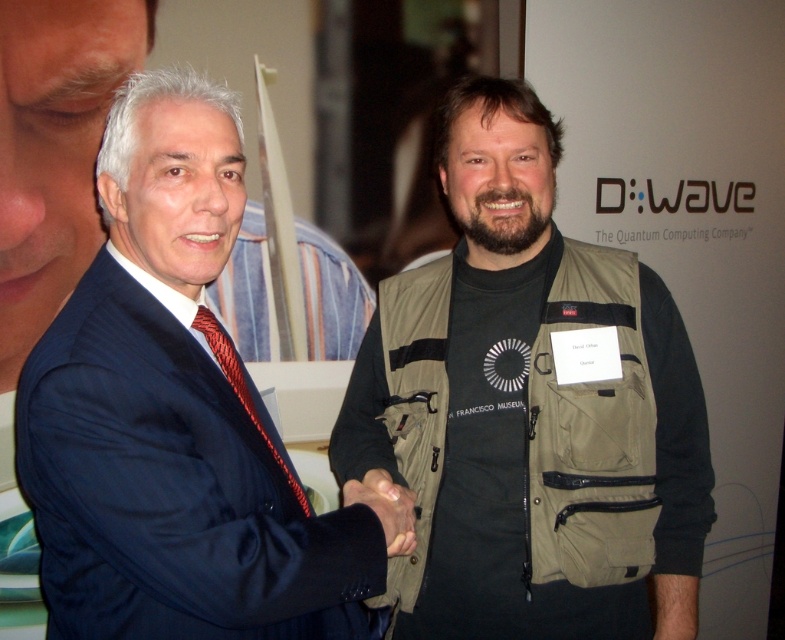
Question: Which object is closer to the camera taking this photo?

Choices:
 (A) smooth skin hand at center
 (B) khaki fabric vest at center

Answer: (A)

Question: Does khaki fabric vest at center appear on the left side of matte blue suit at center?

Choices:
 (A) no
 (B) yes

Answer: (A)

Question: Does khaki fabric vest at center appear on the left side of smooth skin hand at center?

Choices:
 (A) yes
 (B) no

Answer: (B)

Question: Among these objects, which one is farthest from the camera?

Choices:
 (A) khaki fabric vest at center
 (B) smooth skin hand at center
 (C) matte blue suit at center

Answer: (A)

Question: Which point is closer to the camera?

Choices:
 (A) (27, 360)
 (B) (414, 472)
 (C) (411, 497)

Answer: (A)

Question: Where is khaki fabric vest at center located in relation to smooth skin hand at center in the image?

Choices:
 (A) left
 (B) right

Answer: (B)